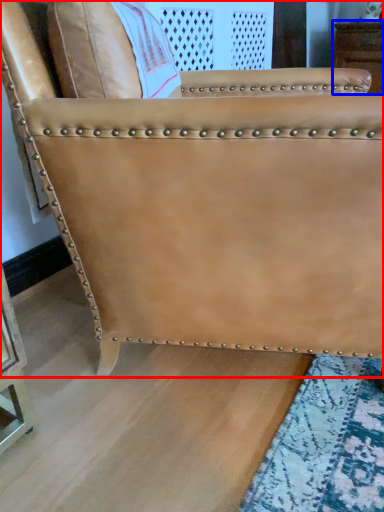
Question: Among these objects, which one is farthest to the camera, chair (highlighted by a red box) or furniture (highlighted by a blue box)?

Choices:
 (A) chair
 (B) furniture

Answer: (B)